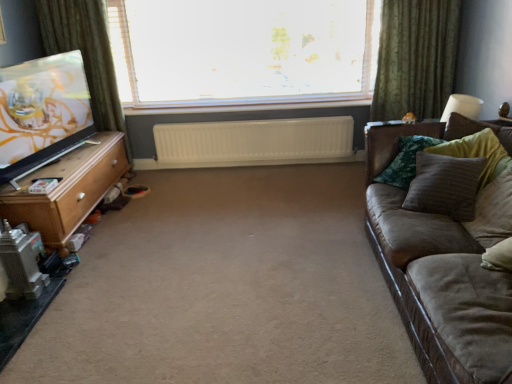
Question: Is green fabric curtain at left, the first curtain in the left-to-right sequence, at the right side of white plastic radiator at center?

Choices:
 (A) no
 (B) yes

Answer: (A)

Question: Considering the relative sizes of green fabric curtain at left, which is counted as the second curtain, starting from the right, and white plastic radiator at center in the image provided, is green fabric curtain at left, which is counted as the second curtain, starting from the right, thinner than white plastic radiator at center?

Choices:
 (A) yes
 (B) no

Answer: (B)

Question: Can you confirm if green fabric curtain at left, which is counted as the second curtain, starting from the right, is positioned to the left of white plastic radiator at center?

Choices:
 (A) no
 (B) yes

Answer: (B)

Question: Does green fabric curtain at left, the first curtain in the left-to-right sequence, have a lesser height compared to white plastic radiator at center?

Choices:
 (A) no
 (B) yes

Answer: (A)

Question: Does green fabric curtain at left, the first curtain in the left-to-right sequence, turn towards white plastic radiator at center?

Choices:
 (A) no
 (B) yes

Answer: (A)

Question: Considering the positions of point (264, 49) and point (52, 16), is point (264, 49) closer or farther from the camera than point (52, 16)?

Choices:
 (A) closer
 (B) farther

Answer: (B)

Question: Based on their sizes in the image, would you say transparent glass window at center is bigger or smaller than green fabric curtain at left, which is counted as the second curtain, starting from the right?

Choices:
 (A) small
 (B) big

Answer: (B)

Question: In terms of height, does transparent glass window at center look taller or shorter compared to green fabric curtain at left, which is counted as the second curtain, starting from the right?

Choices:
 (A) tall
 (B) short

Answer: (B)

Question: Based on their positions, is transparent glass window at center located to the left or right of green fabric curtain at left, which is counted as the second curtain, starting from the right?

Choices:
 (A) right
 (B) left

Answer: (A)

Question: Is beige carpet at center to the left or to the right of textured brown pillow at right, acting as the 3th pillow starting from the front, in the image?

Choices:
 (A) left
 (B) right

Answer: (A)

Question: Looking at their shapes, would you say beige carpet at center is wider or thinner than textured brown pillow at right, acting as the 3th pillow starting from the front?

Choices:
 (A) wide
 (B) thin

Answer: (A)

Question: From a real-world perspective, is beige carpet at center positioned above or below textured brown pillow at right, which appears as the 2th pillow when viewed from the back?

Choices:
 (A) below
 (B) above

Answer: (A)

Question: From the image's perspective, is beige carpet at center located above or below textured brown pillow at right, which appears as the 2th pillow when viewed from the back?

Choices:
 (A) below
 (B) above

Answer: (A)

Question: In terms of size, does white plastic radiator at center appear bigger or smaller than transparent glass window at center?

Choices:
 (A) small
 (B) big

Answer: (A)

Question: Visually, is white plastic radiator at center positioned to the left or to the right of transparent glass window at center?

Choices:
 (A) left
 (B) right

Answer: (B)